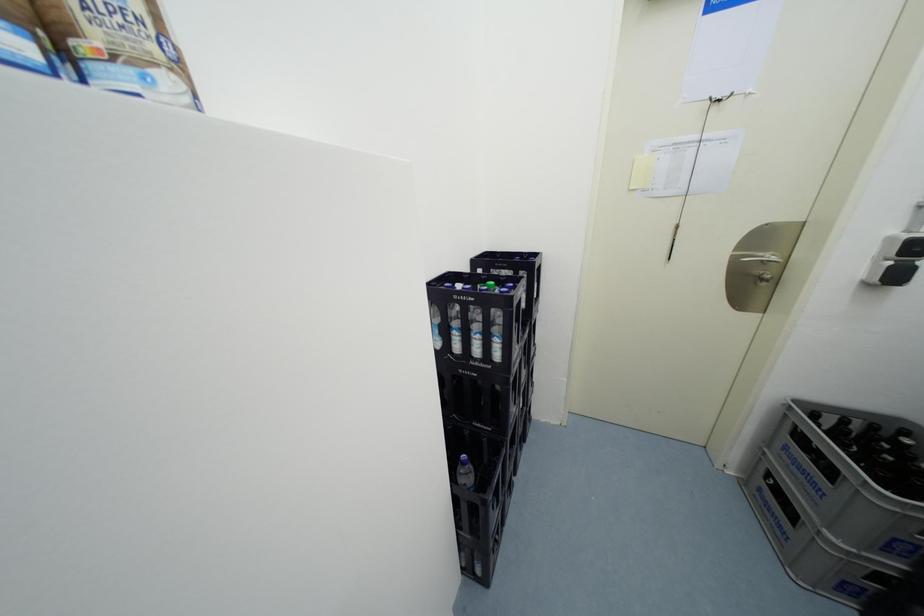
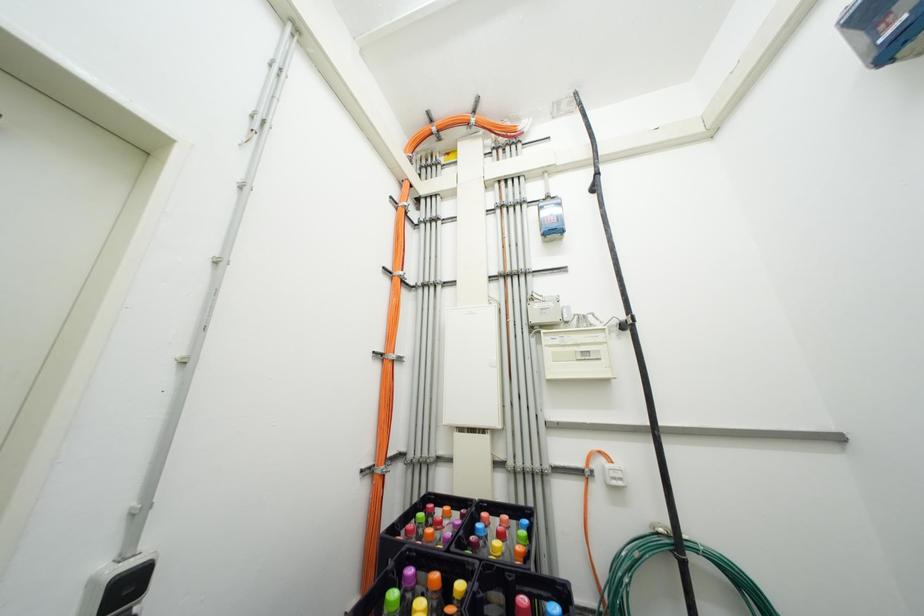
How did the camera likely rotate?

The camera's rotation is toward right-up.